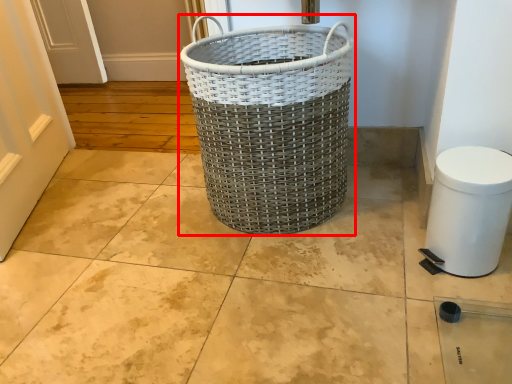
Question: Observing the image, what is the correct spatial positioning of waste container (annotated by the red box) in reference to gray?

Choices:
 (A) right
 (B) left

Answer: (B)